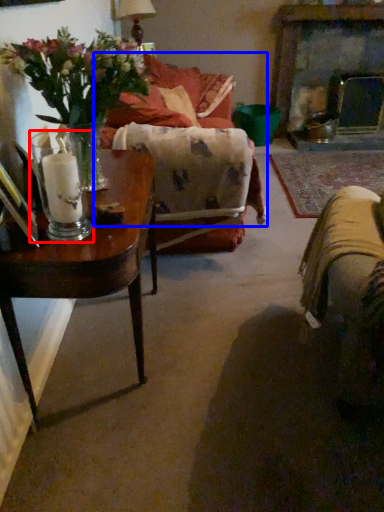
Question: Which of the following is the farthest to the observer, candle holder (highlighted by a red box) or couch (highlighted by a blue box)?

Choices:
 (A) candle holder
 (B) couch

Answer: (B)